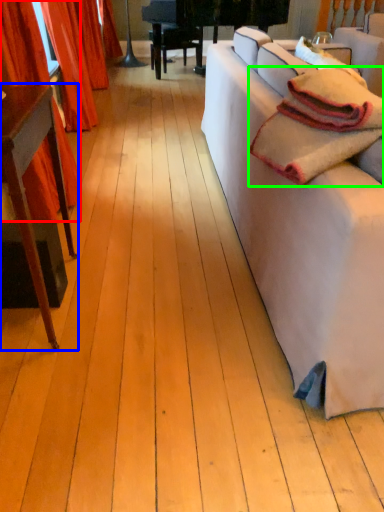
Question: Considering the real-world distances, which object is farthest from curtain (highlighted by a red box)? table (highlighted by a blue box) or blanket (highlighted by a green box)?

Choices:
 (A) table
 (B) blanket

Answer: (B)